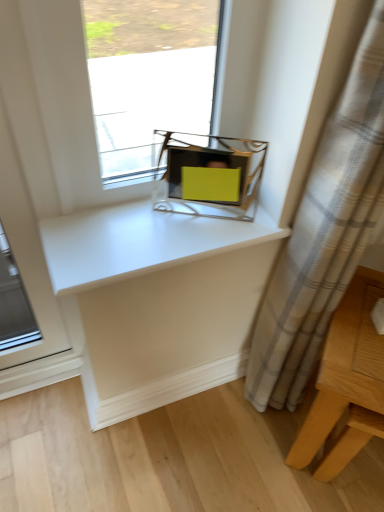
Where is `free space above white glossy counter top at center (from a real-world perspective)`? free space above white glossy counter top at center (from a real-world perspective) is located at coordinates [157, 225].